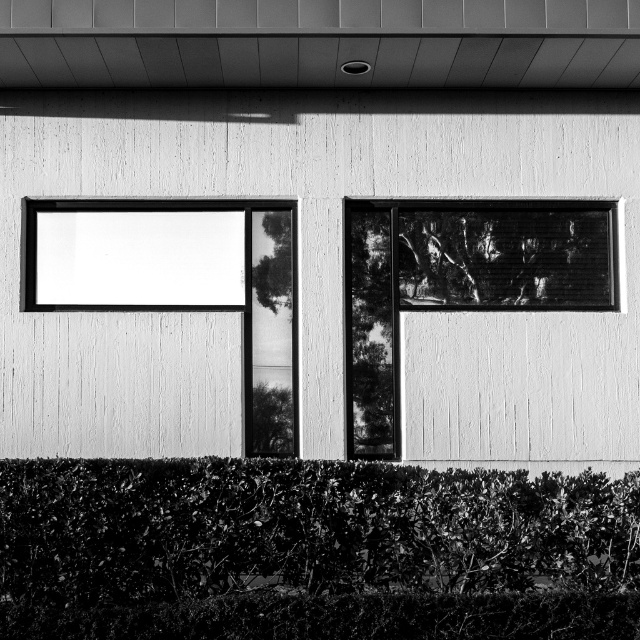
Question: Is green leafy hedge at lower center smaller than smooth glass window at center right?

Choices:
 (A) yes
 (B) no

Answer: (B)

Question: Does green leafy hedge at lower center have a greater width compared to smooth glass window at center right?

Choices:
 (A) no
 (B) yes

Answer: (B)

Question: Which object is closer to the camera taking this photo?

Choices:
 (A) smooth glass window at center right
 (B) green leafy hedge at lower center

Answer: (B)

Question: Is green leafy hedge at lower center above smooth glass window at center right?

Choices:
 (A) no
 (B) yes

Answer: (A)

Question: Which of these objects is positioned closest to the green leafy hedge at lower center?

Choices:
 (A) transparent glass window at upper left
 (B) smooth glass window at center right

Answer: (A)

Question: Which point appears farthest from the camera in this image?

Choices:
 (A) (232, 246)
 (B) (376, 330)

Answer: (B)